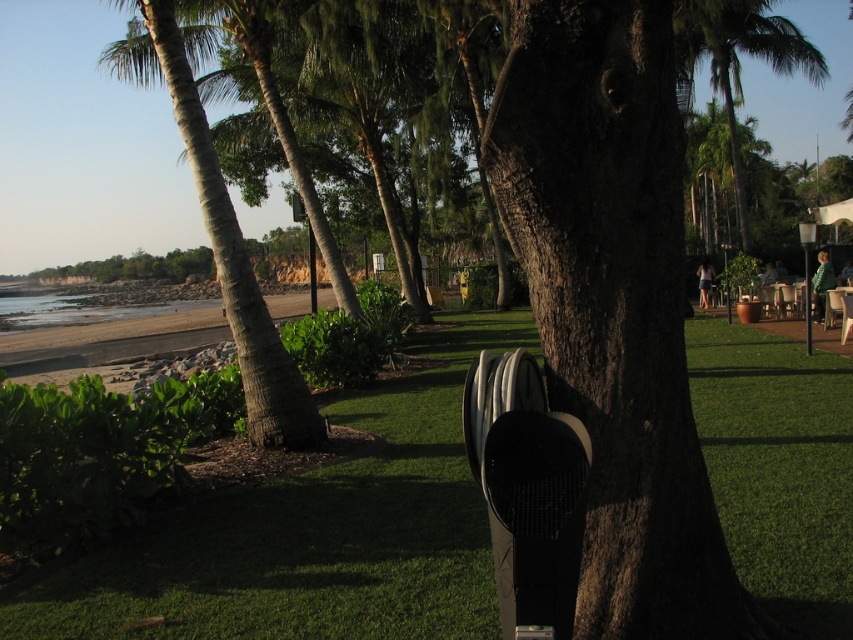
Question: Can you confirm if green grass at center is thinner than white plastic beach chair at center?

Choices:
 (A) no
 (B) yes

Answer: (A)

Question: Can you confirm if green leafy palm tree at upper right is positioned above green leafy palm tree at upper center?

Choices:
 (A) no
 (B) yes

Answer: (A)

Question: Which object appears closest to the camera in this image?

Choices:
 (A) white plastic beach chair at center
 (B) green leafy palm tree at upper right
 (C) green grass at center

Answer: (A)

Question: Which point is farther to the camera?

Choices:
 (A) green leafy palm tree at upper center
 (B) green leafy palm tree at upper right
 (C) green grass at center

Answer: (A)

Question: Among these points, which one is nearest to the camera?

Choices:
 (A) click(x=125, y=563)
 (B) click(x=699, y=54)
 (C) click(x=741, y=125)

Answer: (A)

Question: Does white plastic beach chair at center have a larger size compared to green leafy palm tree at upper center?

Choices:
 (A) no
 (B) yes

Answer: (A)